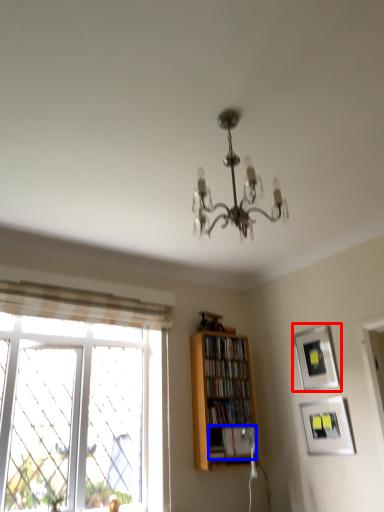
Question: Which object is closer to the camera taking this photo, picture frame (highlighted by a red box) or book (highlighted by a blue box)?

Choices:
 (A) picture frame
 (B) book

Answer: (A)